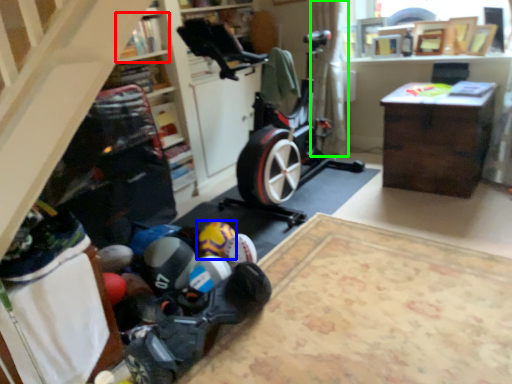
Question: Which object is the farthest from shelf (highlighted by a red box)? Choose among these: toy (highlighted by a blue box) or curtain (highlighted by a green box).

Choices:
 (A) toy
 (B) curtain

Answer: (B)